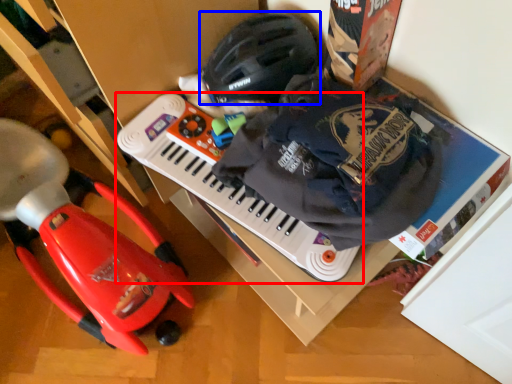
Question: Which object appears closest to the camera in this image, musical keyboard (highlighted by a red box) or helmet (highlighted by a blue box)?

Choices:
 (A) musical keyboard
 (B) helmet

Answer: (A)